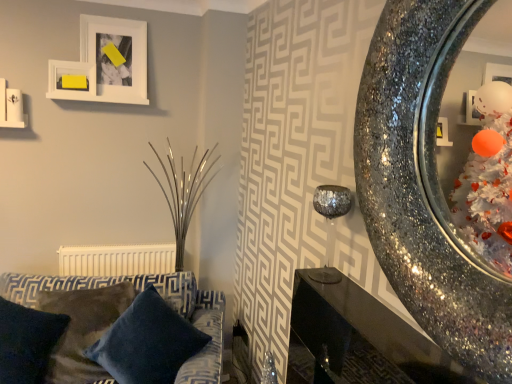
Question: From the image's perspective, is velvety dark blue pillow at lower left positioned above or below white matte radiator at lower left?

Choices:
 (A) above
 (B) below

Answer: (B)

Question: In terms of height, does velvety dark blue pillow at lower left look taller or shorter compared to white matte radiator at lower left?

Choices:
 (A) short
 (B) tall

Answer: (B)

Question: Considering the real-world distances, which object is farthest from the white matte radiator at lower left?

Choices:
 (A) white matte picture frame at upper left, the first picture frame in the right-to-left sequence
 (B) velvet blue couch at lower left
 (C) sparkly metallic candle holder at upper right
 (D) sparkly metallic mirror at right
 (E) velvety dark blue pillow at lower left

Answer: (D)

Question: Which object is positioned closest to the yellow paper at upper left, which is the 2th picture frame in right-to-left order?

Choices:
 (A) sparkly metallic candle holder at upper right
 (B) white matte radiator at lower left
 (C) sparkly metallic mirror at right
 (D) velvety dark blue pillow at lower left
 (E) shiny metallic table at lower right

Answer: (B)